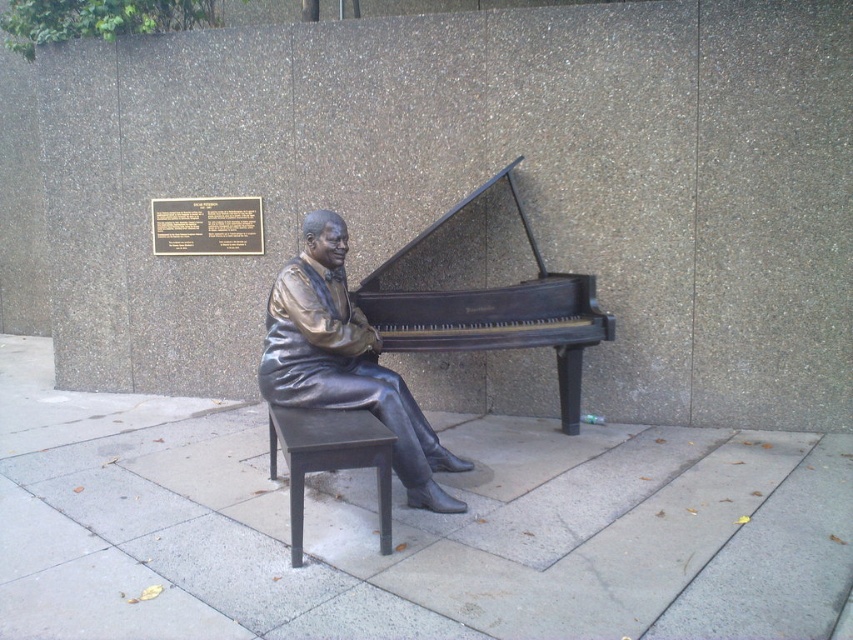
Question: Which point appears closest to the camera in this image?

Choices:
 (A) (798, 440)
 (B) (297, 556)

Answer: (B)

Question: Does bronze statue at center appear on the left side of bronze polished piano at center?

Choices:
 (A) no
 (B) yes

Answer: (B)

Question: Considering the real-world distances, which object is closest to the matte black stool at center?

Choices:
 (A) bronze polished piano at center
 (B) gray concrete pavement at center

Answer: (B)

Question: Is gray concrete pavement at center below bronze polished piano at center?

Choices:
 (A) no
 (B) yes

Answer: (B)

Question: Is gray concrete pavement at center above matte black stool at center?

Choices:
 (A) no
 (B) yes

Answer: (A)

Question: Which point is closer to the camera taking this photo?

Choices:
 (A) (392, 321)
 (B) (793, 625)
 (C) (335, 360)
 (D) (340, 410)

Answer: (B)